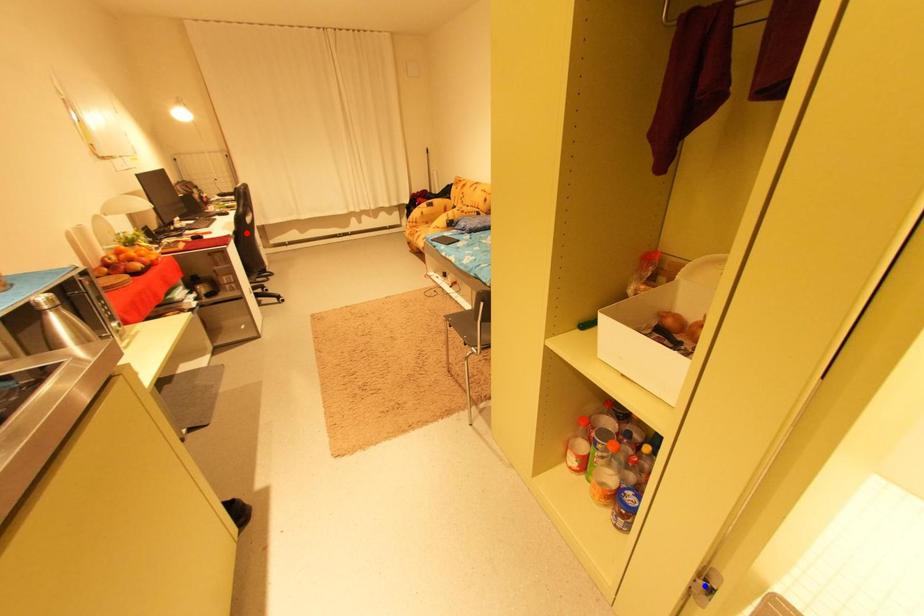
Question: In the image, two points are highlighted. Which point is nearer to the camera? Reply with the corresponding letter.

Choices:
 (A) blue point
 (B) red point

Answer: (A)